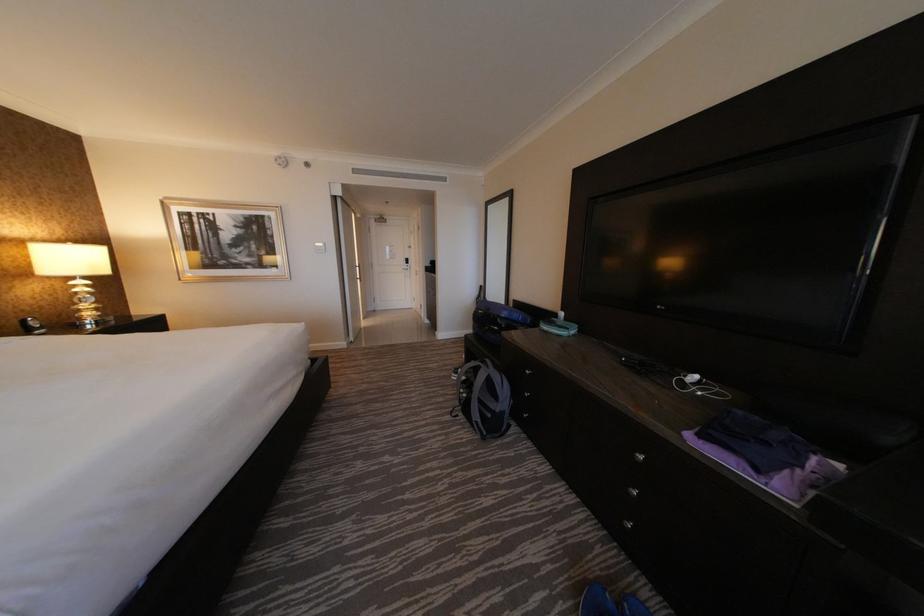
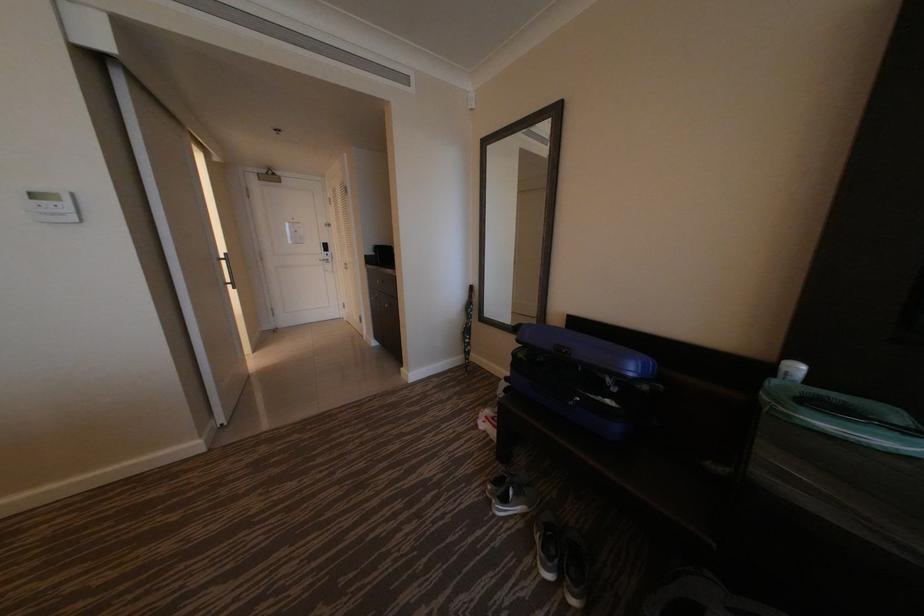
Question: The images are taken continuously from a first-person perspective. In which direction are you moving?

Choices:
 (A) Left
 (B) Right
 (C) Forward
 (D) Backward

Answer: (C)